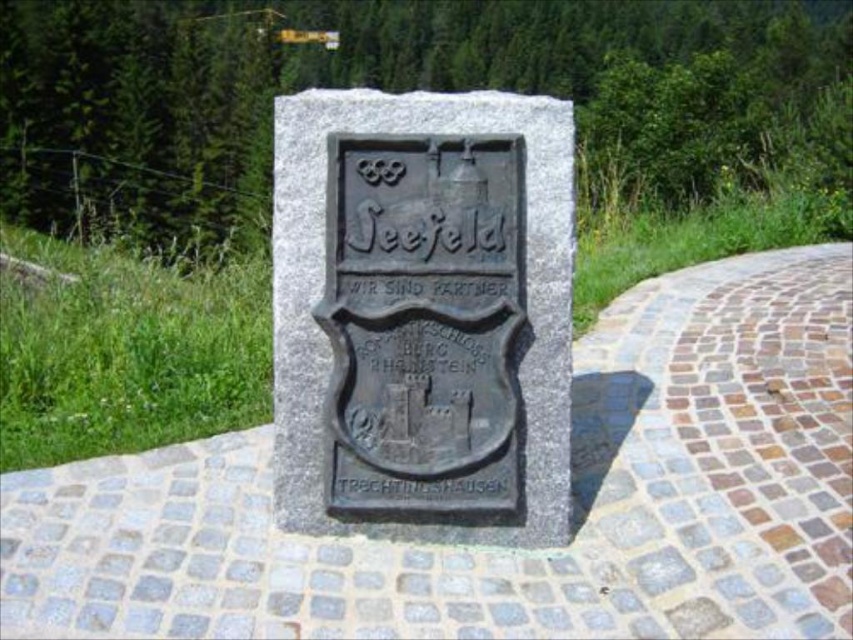
You are standing in front of the monument and want to touch the bronze plaque at center and the black stone sign at center. Which one can you reach first without moving your position?

The bronze plaque at center is closer to the viewer than the black stone sign at center, so you can reach the bronze plaque at center first without moving your position.

You are standing at the entrance of the monument and want to walk towards the gray stone path at center and the black stone sign at center. Which object is taller and would block your view more if you were to stand in front of them?

The gray stone path at center is taller than the black stone sign at center, so it would block your view more if you were to stand in front of them.

Based on the photo, you are a visitor at the monument and want to walk along the gray stone path at center. Can you walk the entire length of the bronze plaque at center while staying on the path?

The gray stone path at center is shorter than the bronze plaque at center, so you cannot walk the entire length of the bronze plaque at center while staying on the path.